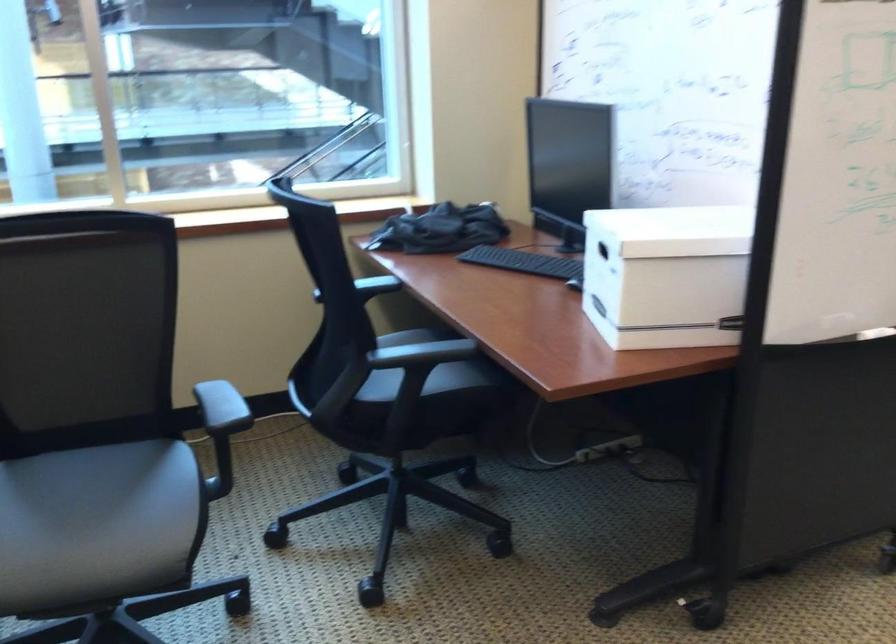
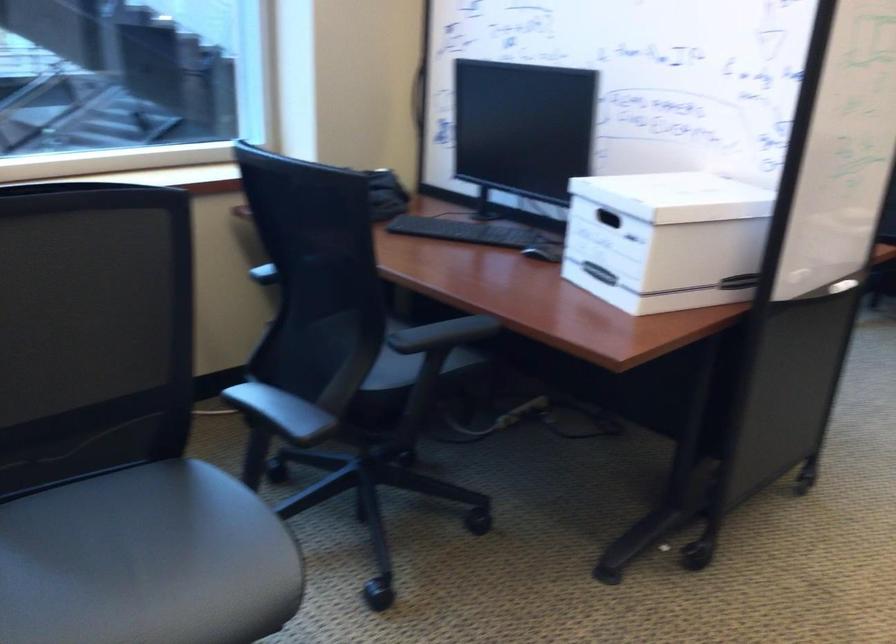
Where in the second image is the point corresponding to (x=416, y=353) from the first image?

(442, 334)